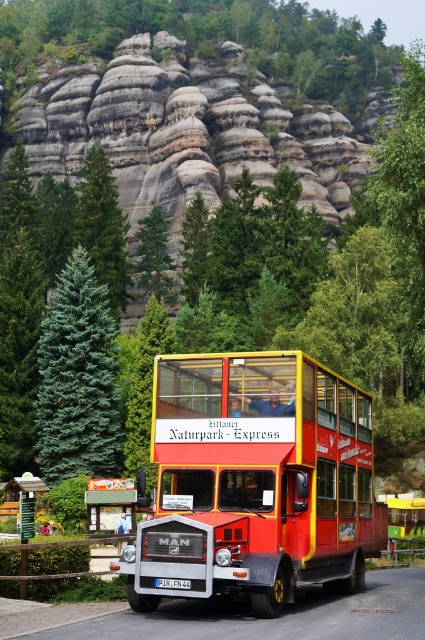
Is point (368, 474) closer to camera compared to point (189, 586)?

That is False.

Does red matte double-decker bus at center have a greater height compared to white plastic license plate at center?

Yes.

Does point (226, 472) come in front of point (173, 579)?

No.

You are a GUI agent. You are given a task and a screenshot of the screen. Output one action in this format:
    pyautogui.click(x=<x>, y=<y>)
    Task: Click on the red matte double-decker bus at center
    Image resolution: width=425 pixels, height=640 pixels.
    Given the screenshot: What is the action you would take?
    pyautogui.click(x=255, y=481)

Does red matte double-decker bus at center have a larger size compared to blue-green coniferous tree at left?

No.

Does point (345, 588) come behind point (74, 266)?

That is False.

Describe the element at coordinates (255, 481) in the screenshot. I see `red matte double-decker bus at center` at that location.

Locate an element on the screen. red matte double-decker bus at center is located at coordinates pos(255,481).

From the picture: Who is shorter, blue-green coniferous tree at left or white plastic license plate at center?

With less height is white plastic license plate at center.

Which is above, blue-green coniferous tree at left or white plastic license plate at center?

blue-green coniferous tree at left

Find the location of a particular element. The height and width of the screenshot is (640, 425). blue-green coniferous tree at left is located at coordinates (78, 378).

This screenshot has width=425, height=640. I want to click on blue-green coniferous tree at left, so click(78, 378).